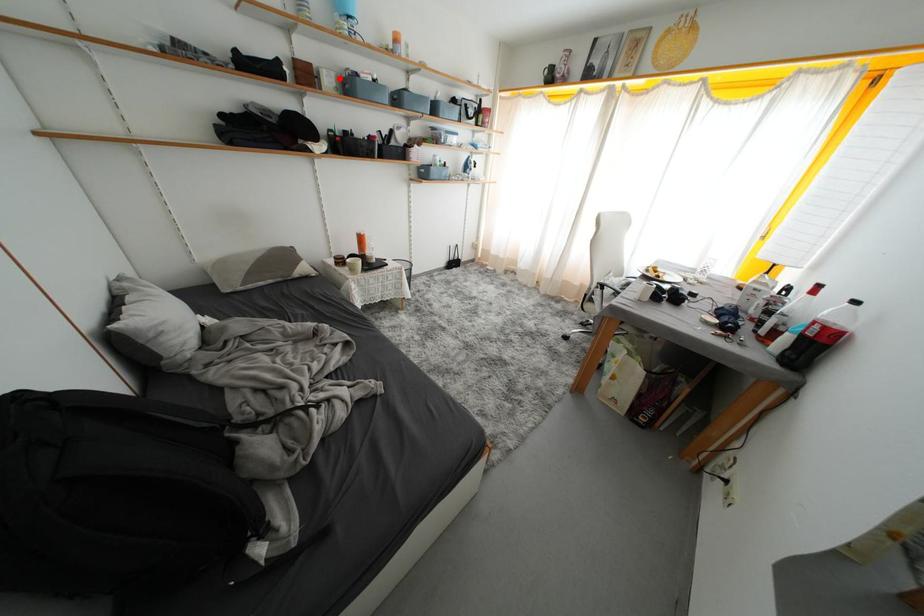
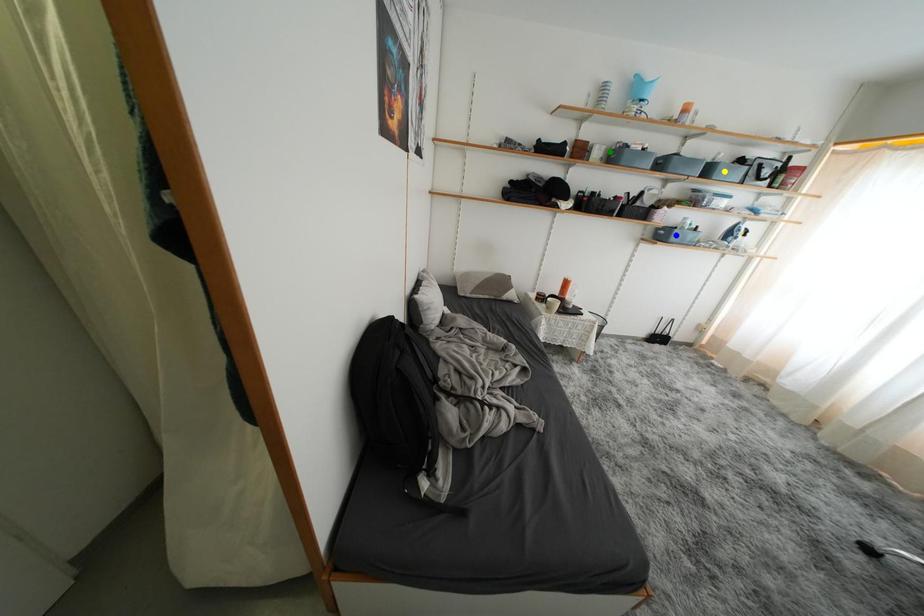
Question: I am providing you with two images of the same scene from different viewpoints. A red point is marked on the first image. You are given multiple points on the second image. Which point in image 2 represents the same 3d spot as the red point in image 1?

Choices:
 (A) blue point
 (B) yellow point
 (C) green point

Answer: (C)